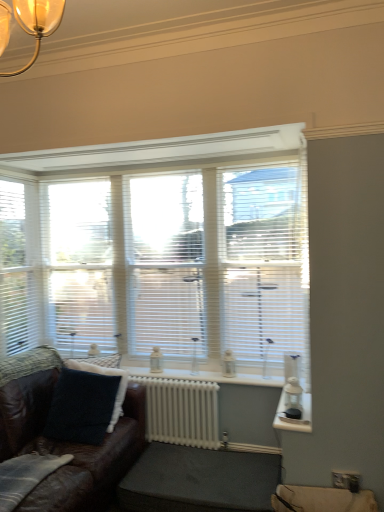
Where is `dark gray fabric footrest at lower center`? The height and width of the screenshot is (512, 384). dark gray fabric footrest at lower center is located at coordinates (199, 480).

Describe the element at coordinates (106, 375) in the screenshot. The image size is (384, 512). I see `dark blue fabric pillow at lower left` at that location.

What do you see at coordinates (181, 411) in the screenshot?
I see `white painted metal radiator at center` at bounding box center [181, 411].

The image size is (384, 512). What do you see at coordinates (165, 263) in the screenshot?
I see `transparent plastic glass door at center` at bounding box center [165, 263].

This screenshot has height=512, width=384. What do you see at coordinates (79, 264) in the screenshot? I see `white plastic blinds at left` at bounding box center [79, 264].

This screenshot has height=512, width=384. In order to click on dark gray fabric footrest at lower center in this screenshot , I will do `click(199, 480)`.

Would you say transparent plastic glass door at center contains white plastic blinds at left?

Definitely not — white plastic blinds at left is not inside transparent plastic glass door at center.

Does transparent plastic glass door at center have a greater width compared to white plastic blinds at left?

In fact, transparent plastic glass door at center might be narrower than white plastic blinds at left.

Considering the relative positions of transparent plastic glass door at center and white plastic blinds at left in the image provided, is transparent plastic glass door at center in front of white plastic blinds at left?

Yes, the depth of transparent plastic glass door at center is less than that of white plastic blinds at left.

Considering the relative sizes of transparent plastic glass door at center and white plastic blinds at left in the image provided, is transparent plastic glass door at center shorter than white plastic blinds at left?

Yes, transparent plastic glass door at center is shorter than white plastic blinds at left.

How many degrees apart are the facing directions of transparent plastic glass door at center and white painted metal radiator at center?

The angular difference between transparent plastic glass door at center and white painted metal radiator at center is 0.643 degrees.

Does point (167, 290) appear closer or farther from the camera than point (178, 397)?

Point (167, 290) is farther from the camera than point (178, 397).

Is transparent plastic glass door at center aimed at white painted metal radiator at center?

No, transparent plastic glass door at center does not turn towards white painted metal radiator at center.

From the image's perspective, is transparent plastic glass door at center above or below white painted metal radiator at center?

transparent plastic glass door at center is above white painted metal radiator at center.

Which is closer, [3,301] or [253,454]?

Point [3,301].

Does white blinds at center have a greater width compared to dark gray fabric footrest at lower center?

No, white blinds at center is not wider than dark gray fabric footrest at lower center.

Is white blinds at center at the left side of dark gray fabric footrest at lower center?

Yes.

Who is taller, white blinds at center or dark gray fabric footrest at lower center?

white blinds at center.

What's the angular difference between white plastic blinds at left and dark blue fabric pillow at lower left's facing directions?

16.9 degrees.

Based on the photo, is white plastic blinds at left wider than dark blue fabric pillow at lower left?

No.

In the scene shown: Which object is closer to the camera taking this photo, white plastic blinds at left or dark blue fabric pillow at lower left?

Positioned in front is dark blue fabric pillow at lower left.

Is white plastic blinds at left not close to dark blue fabric pillow at lower left?

No.

From the image's perspective, which one is positioned higher, dark gray fabric footrest at lower center or brown leather couch at lower left?

brown leather couch at lower left is shown above in the image.

Is dark gray fabric footrest at lower center touching brown leather couch at lower left?

No, dark gray fabric footrest at lower center is not touching brown leather couch at lower left.

Is dark gray fabric footrest at lower center further to camera compared to brown leather couch at lower left?

Yes.

Between dark gray fabric footrest at lower center and dark blue fabric pillow at lower left, which one is positioned in front?

dark gray fabric footrest at lower center is in front.

Considering the relative positions of dark gray fabric footrest at lower center and dark blue fabric pillow at lower left in the image provided, is dark gray fabric footrest at lower center to the right of dark blue fabric pillow at lower left from the viewer's perspective?

Correct, you'll find dark gray fabric footrest at lower center to the right of dark blue fabric pillow at lower left.

Who is shorter, dark gray fabric footrest at lower center or dark blue fabric pillow at lower left?

dark gray fabric footrest at lower center is shorter.

From the image's perspective, which one is positioned lower, dark gray fabric footrest at lower center or dark blue fabric pillow at lower left?

dark gray fabric footrest at lower center, from the image's perspective.

From a real-world perspective, is dark blue fabric pillow at lower left positioned over dark gray fabric footrest at lower center based on gravity?

Yes, from a real-world perspective, dark blue fabric pillow at lower left is above dark gray fabric footrest at lower center.

Is dark blue fabric pillow at lower left not inside dark gray fabric footrest at lower center?

That's correct, dark blue fabric pillow at lower left is outside of dark gray fabric footrest at lower center.

Is dark blue fabric pillow at lower left facing towards dark gray fabric footrest at lower center?

No, dark blue fabric pillow at lower left is not oriented towards dark gray fabric footrest at lower center.

Is dark blue fabric pillow at lower left next to dark gray fabric footrest at lower center and touching it?

dark blue fabric pillow at lower left and dark gray fabric footrest at lower center are clearly separated.

Where is `glass door lying above the white plastic blinds at left (from the image's perspective)`? This screenshot has height=512, width=384. glass door lying above the white plastic blinds at left (from the image's perspective) is located at coordinates click(165, 263).

Where is `radiator below the transparent plastic glass door at center (from the image's perspective)`? The height and width of the screenshot is (512, 384). radiator below the transparent plastic glass door at center (from the image's perspective) is located at coordinates (181, 411).

Which object lies further to the anchor point transparent plastic glass door at center, white blinds at center or white plastic blinds at left?

white plastic blinds at left lies further to transparent plastic glass door at center than the other object.

Which object lies nearer to the anchor point dark gray fabric footrest at lower center, brown leather couch at lower left or dark blue fabric pillow at lower left?

The object closer to dark gray fabric footrest at lower center is brown leather couch at lower left.

Considering their positions, is dark gray fabric footrest at lower center positioned further to white blinds at center than white painted metal radiator at center?

dark gray fabric footrest at lower center.

From the image, which object appears to be nearer to transparent plastic glass door at center, white plastic blinds at left or dark gray fabric footrest at lower center?

white plastic blinds at left is closer to transparent plastic glass door at center.

Looking at the image, which one is located further to dark blue fabric pillow at lower left, white painted metal radiator at center or transparent plastic glass door at center?

transparent plastic glass door at center is positioned further to the anchor dark blue fabric pillow at lower left.

From the image, which object appears to be farther from dark gray fabric footrest at lower center, transparent plastic glass door at center or brown leather couch at lower left?

Among the two, transparent plastic glass door at center is located further to dark gray fabric footrest at lower center.

Estimate the real-world distances between objects in this image. Which object is further from dark gray fabric footrest at lower center, brown leather couch at lower left or transparent plastic glass door at center?

The object further to dark gray fabric footrest at lower center is transparent plastic glass door at center.

Considering their positions, is white painted metal radiator at center positioned further to white blinds at center than white plastic blinds at left?

Among the two, white painted metal radiator at center is located further to white blinds at center.

Where is `pillow between white blinds at center and white painted metal radiator at center in the up-down direction`? This screenshot has width=384, height=512. pillow between white blinds at center and white painted metal radiator at center in the up-down direction is located at coordinates (106, 375).

Find the location of `pillow that lies between white plastic blinds at left and dark gray fabric footrest at lower center from top to bottom`. pillow that lies between white plastic blinds at left and dark gray fabric footrest at lower center from top to bottom is located at coordinates pos(106,375).

This screenshot has height=512, width=384. I want to click on footrest between brown leather couch at lower left and dark blue fabric pillow at lower left in the front-back direction, so click(199, 480).

Find the location of a particular element. The image size is (384, 512). pillow between white plastic blinds at left and white painted metal radiator at center vertically is located at coordinates (106, 375).